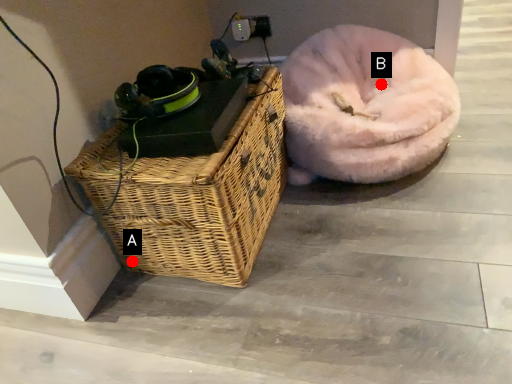
Question: Two points are circled on the image, labeled by A and B beside each circle. Which point appears farthest from the camera in this image?

Choices:
 (A) A is further
 (B) B is further

Answer: (B)